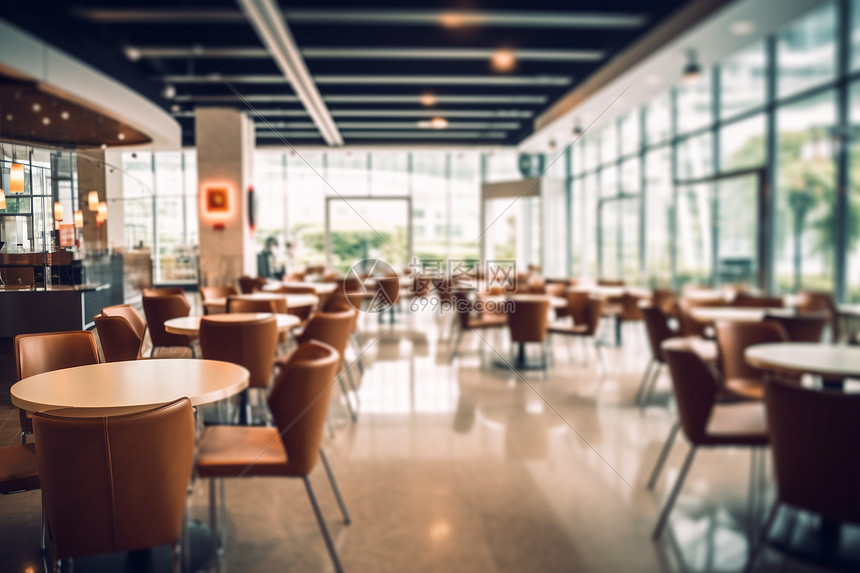
Locate an element on the screen. This screenshot has height=573, width=860. table is located at coordinates (177, 378), (183, 328), (297, 300), (320, 288), (544, 300), (607, 292), (726, 312), (778, 354), (483, 285).